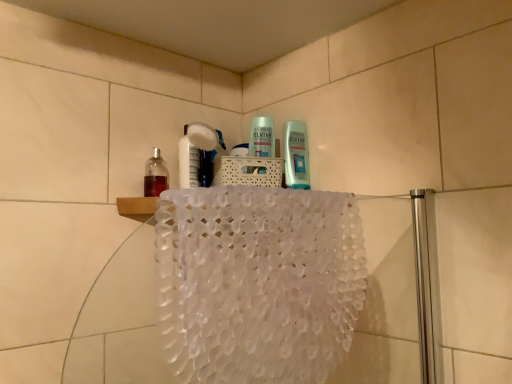
Question: Is translucent plastic bottle at upper left wider or thinner than translucent plastic bath towel at upper center?

Choices:
 (A) thin
 (B) wide

Answer: (A)

Question: Is translucent plastic bottle at upper left to the left or to the right of translucent plastic bath towel at upper center in the image?

Choices:
 (A) right
 (B) left

Answer: (B)

Question: Considering their positions, is translucent plastic bottle at upper left located in front of or behind translucent plastic bath towel at upper center?

Choices:
 (A) front
 (B) behind

Answer: (B)

Question: Which is correct: translucent plastic bath towel at upper center is inside translucent plastic bottle at upper left, or outside of it?

Choices:
 (A) outside
 (B) inside

Answer: (A)

Question: Considering the positions of point (283, 334) and point (148, 193), is point (283, 334) closer or farther from the camera than point (148, 193)?

Choices:
 (A) closer
 (B) farther

Answer: (A)

Question: Based on their positions, is translucent plastic bath towel at upper center located to the left or right of translucent plastic bottle at upper left?

Choices:
 (A) left
 (B) right

Answer: (B)

Question: From a real-world perspective, relative to translucent plastic bottle at upper left, is translucent plastic bath towel at upper center vertically above or below?

Choices:
 (A) above
 (B) below

Answer: (B)